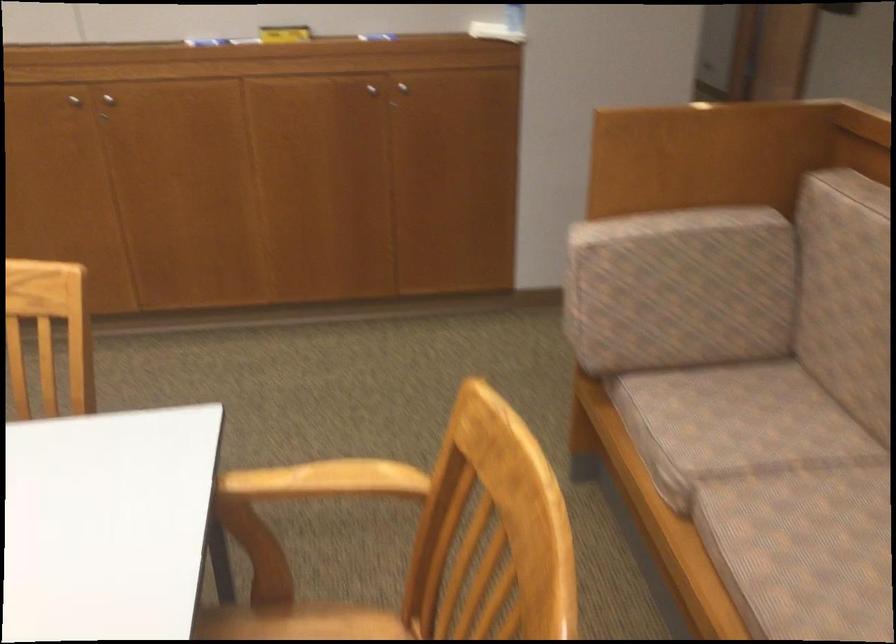
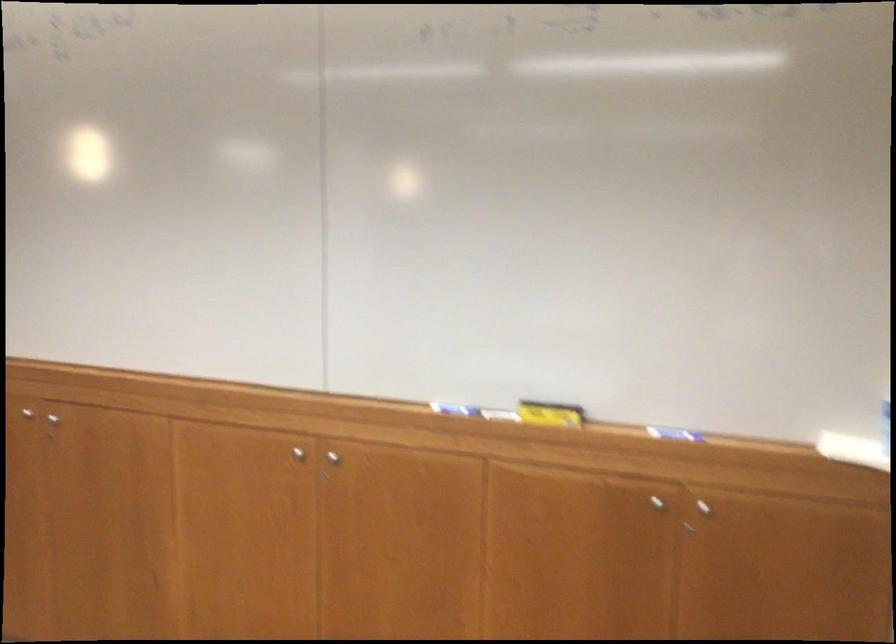
Find the pixel in the second image that matches (81,100) in the first image.

(297, 453)